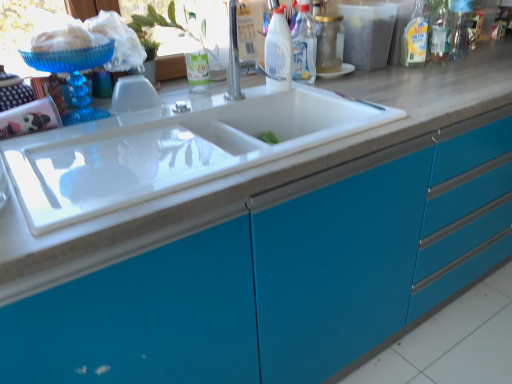
The image size is (512, 384). Identify the location of free point above blue glossy cabinet at center (from a real-world perspective). (330, 94).